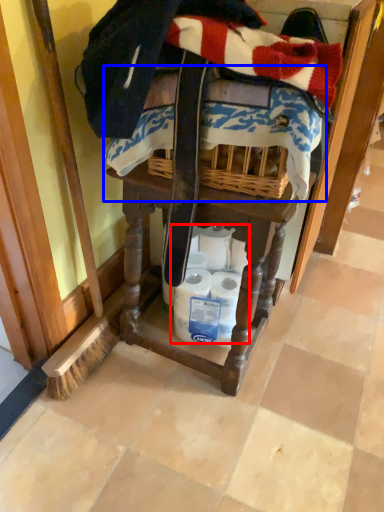
Question: Among these objects, which one is farthest to the camera, toilet paper (highlighted by a red box) or underclothes (highlighted by a blue box)?

Choices:
 (A) toilet paper
 (B) underclothes

Answer: (A)